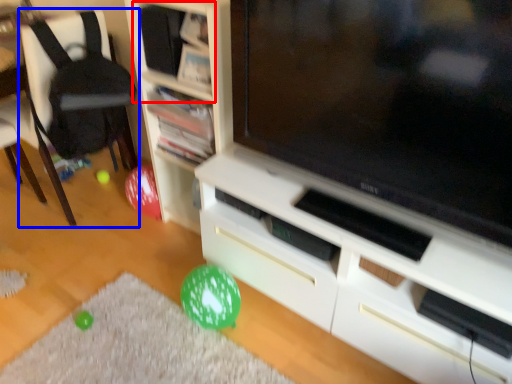
Question: Which object is closer to the camera taking this photo, shelf (highlighted by a red box) or chair (highlighted by a blue box)?

Choices:
 (A) shelf
 (B) chair

Answer: (A)